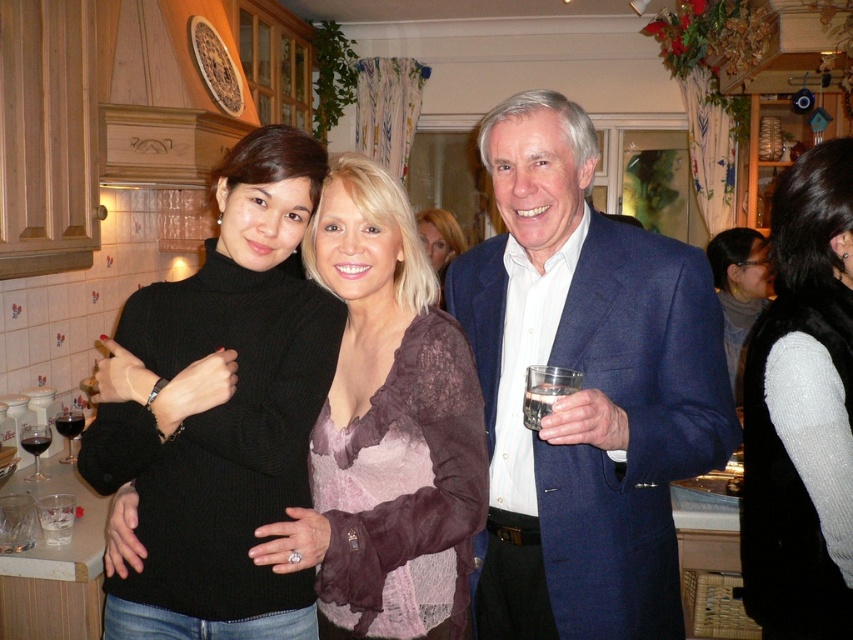
Question: From the image, what is the correct spatial relationship of blue fabric suit at center in relation to dark red glass at left?

Choices:
 (A) above
 (B) below

Answer: (A)

Question: Which point appears farthest from the camera in this image?

Choices:
 (A) (64, 433)
 (B) (505, 499)
 (C) (525, 413)
 (D) (36, 467)

Answer: (A)

Question: Among these objects, which one is farthest from the camera?

Choices:
 (A) blue fabric suit at center
 (B) translucent glass wine at lower left
 (C) black turtleneck sweater at center

Answer: (B)

Question: Among these points, which one is farthest from the camera?

Choices:
 (A) (672, 272)
 (B) (758, 307)

Answer: (B)

Question: In this image, where is blue fabric suit at center located relative to transparent glass at lower left?

Choices:
 (A) above
 (B) below

Answer: (A)

Question: Is black knit sweater at right below matte purple lace top at center?

Choices:
 (A) yes
 (B) no

Answer: (A)